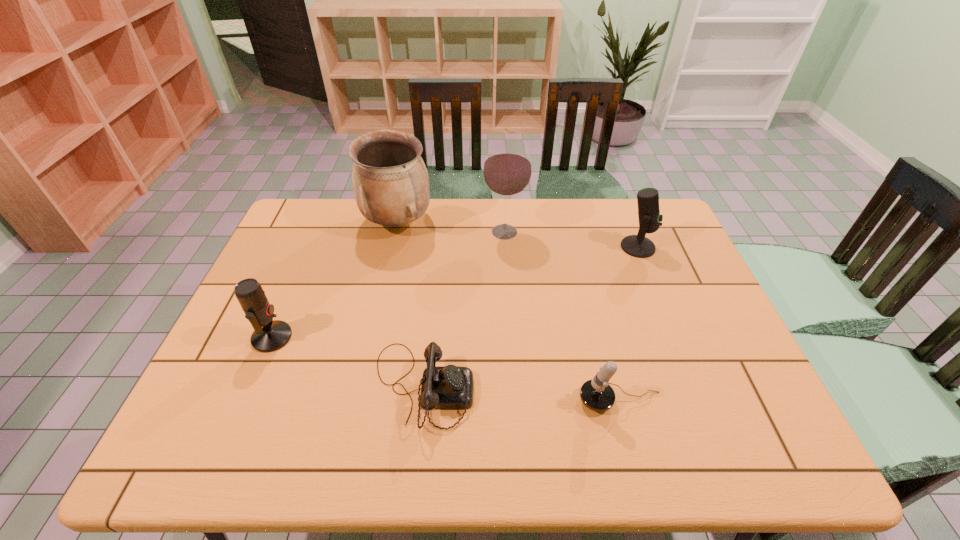
The width and height of the screenshot is (960, 540). I want to click on alcohol, so click(507, 169).

In order to click on urn in this screenshot , I will do `click(390, 181)`.

The width and height of the screenshot is (960, 540). I want to click on the rightmost microphone, so click(650, 220).

You are a GUI agent. You are given a task and a screenshot of the screen. Output one action in this format:
    pyautogui.click(x=<x>, y=<y>)
    Task: Click on the farthest microphone
    This screenshot has height=540, width=960.
    Given the screenshot: What is the action you would take?
    point(650,220)

The image size is (960, 540). I want to click on the second nearest microphone, so click(270, 335).

Where is `the leftmost object`? The width and height of the screenshot is (960, 540). the leftmost object is located at coordinates (270, 335).

What are the coordinates of `the fifth tallest object` in the screenshot? It's located at (596, 394).

The height and width of the screenshot is (540, 960). Find the location of `the nearest microphone`. the nearest microphone is located at coordinates (596, 394).

Locate an element on the screen. The width and height of the screenshot is (960, 540). telephone is located at coordinates (443, 387).

Locate an element on the screen. This screenshot has height=540, width=960. vacant area situated 0.300m on the left of the third object from right to left is located at coordinates (391, 232).